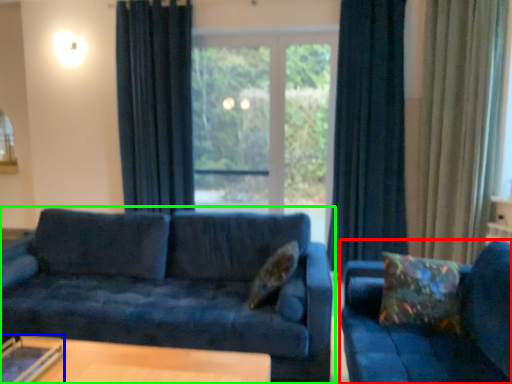
Question: Which is nearer to the studio couch (highlighted by a red box)? glass table (highlighted by a blue box) or studio couch (highlighted by a green box).

Choices:
 (A) glass table
 (B) studio couch

Answer: (B)